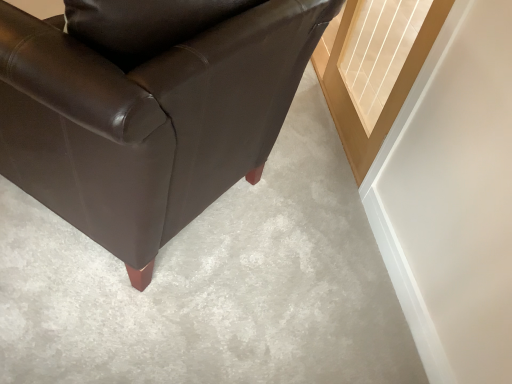
Question: Considering the positions of point (266, 77) and point (439, 9), is point (266, 77) closer or farther from the camera than point (439, 9)?

Choices:
 (A) closer
 (B) farther

Answer: (A)

Question: In terms of size, does matte black leather chair at lower left appear bigger or smaller than clear glass door at upper right?

Choices:
 (A) small
 (B) big

Answer: (B)

Question: Considering the relative positions of matte black leather chair at lower left and clear glass door at upper right in the image provided, is matte black leather chair at lower left to the left or to the right of clear glass door at upper right?

Choices:
 (A) right
 (B) left

Answer: (B)

Question: Considering the positions of point (413, 11) and point (132, 218), is point (413, 11) closer or farther from the camera than point (132, 218)?

Choices:
 (A) closer
 (B) farther

Answer: (B)

Question: In the image, is clear glass door at upper right positioned in front of or behind matte black leather chair at lower left?

Choices:
 (A) front
 (B) behind

Answer: (B)

Question: Which is correct: clear glass door at upper right is inside matte black leather chair at lower left, or outside of it?

Choices:
 (A) outside
 (B) inside

Answer: (A)

Question: From a real-world perspective, is clear glass door at upper right physically located above or below matte black leather chair at lower left?

Choices:
 (A) above
 (B) below

Answer: (B)